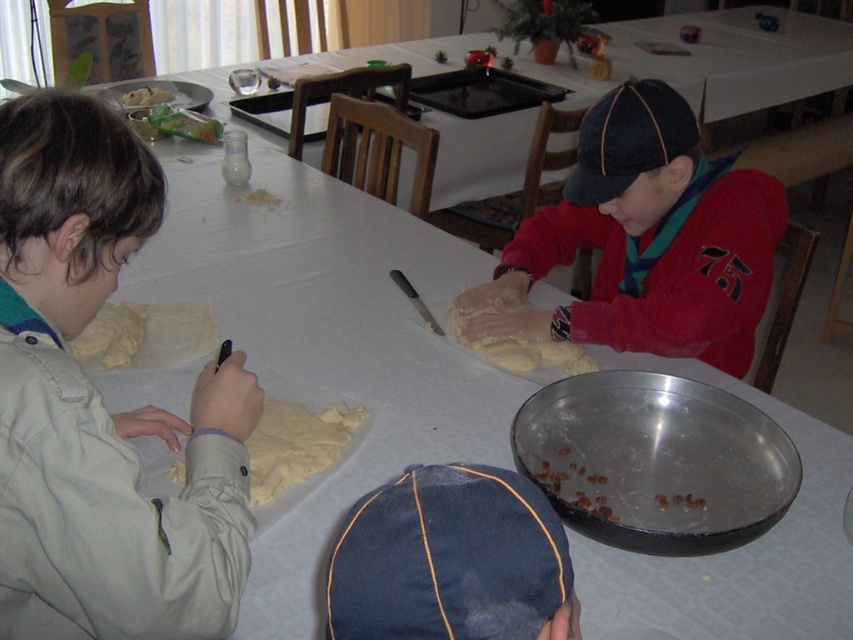
Can you confirm if light beige fabric jacket at left is bigger than denim cap at lower center?

Correct, light beige fabric jacket at left is larger in size than denim cap at lower center.

Who is positioned more to the left, light beige fabric jacket at left or denim cap at lower center?

light beige fabric jacket at left

Between point (67, 134) and point (428, 618), which one is positioned behind?

The point (67, 134) is behind.

Image resolution: width=853 pixels, height=640 pixels. I want to click on light beige fabric jacket at left, so click(x=100, y=404).

Which is in front, point (105, 449) or point (596, 131)?

Point (105, 449) is more forward.

Is light beige fabric jacket at left bigger than red fleece sweater at center?

Incorrect, light beige fabric jacket at left is not larger than red fleece sweater at center.

Where is `light beige fabric jacket at left`? light beige fabric jacket at left is located at coordinates (100, 404).

I want to click on light beige fabric jacket at left, so click(x=100, y=404).

Is light beige fabric jacket at left bigger than yellowish dough at center?

Indeed, light beige fabric jacket at left has a larger size compared to yellowish dough at center.

You are a GUI agent. You are given a task and a screenshot of the screen. Output one action in this format:
    pyautogui.click(x=<x>, y=<y>)
    Task: Click on the light beige fabric jacket at left
    The height and width of the screenshot is (640, 853).
    Given the screenshot: What is the action you would take?
    pyautogui.click(x=100, y=404)

Locate an element on the screen. The width and height of the screenshot is (853, 640). light beige fabric jacket at left is located at coordinates (100, 404).